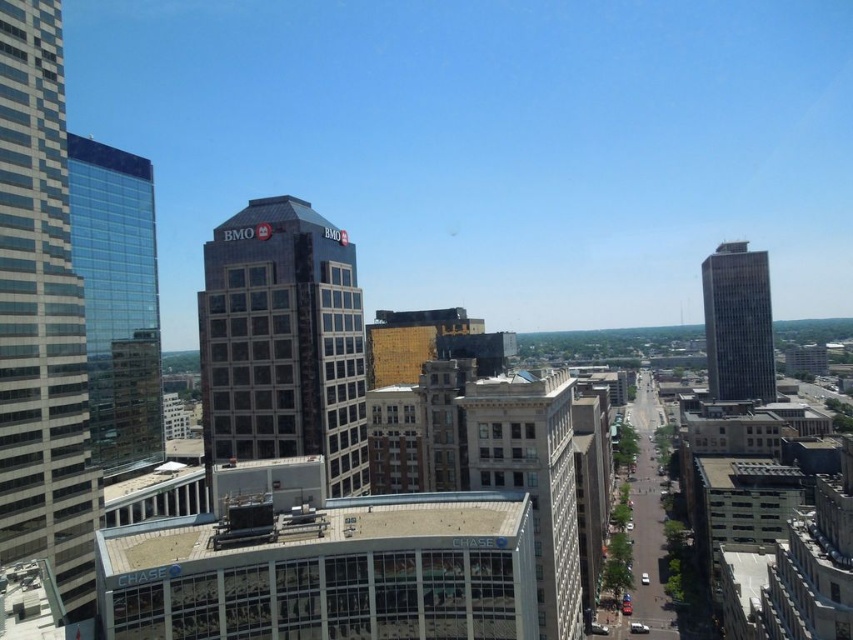
You are a drone operator tasked with flying a drone between two buildings in the city. You need to ensure the drone can safely pass through the space between the dark gray glass building at center and the gray glass skyscraper at right. The drone has a wingspan of 1.5 meters. Can the drone safely navigate this space?

The distance between the dark gray glass building at center and the gray glass skyscraper at right is 191.19 meters. Since the drone has a wingspan of 1.5 meters, it can easily navigate the space between them as the distance is significantly larger than the drone size.

You are a city planner assessing the space between two buildings in the urban landscape. The transparent glass skyscraper at left and the gray glass skyscraper at right are part of your study. Which building has a narrower width?

The transparent glass skyscraper at left has a lesser width compared to the gray glass skyscraper at right, so it is narrower.

You are standing at the center of the scene and want to take a photo of the transparent glass skyscraper at left. Based on its 2D coordinates, in which direction should you point your camera?

The transparent glass skyscraper at left is located at point 0.472 on the x axis and 0.138 on the y axis. Since the x coordinate is 0.472, which is closer to the left edge of the scene, you should point your camera to the left to capture it.